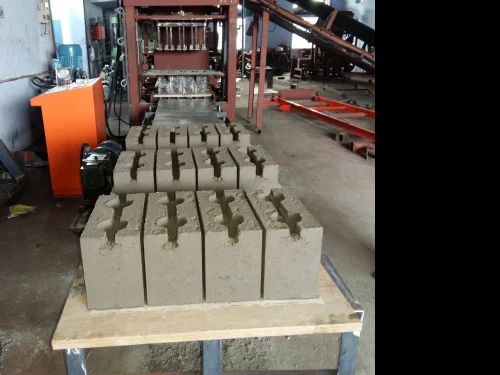
At what (x,y) coordinates should I click in order to perform the action: click on table. Please return your answer as a coordinate pair (x, y). Looking at the image, I should click on (174, 326).